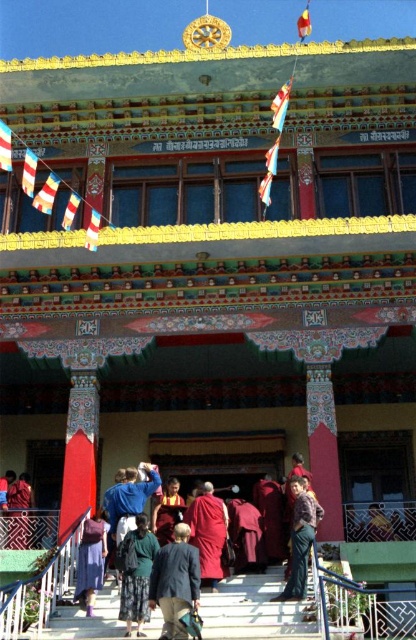
You are a visitor standing in front of the monastery and notice two items of clothing near the entrance. The green fabric skirt at center and the denim pants at lower center. Which one is positioned lower in relation to the other?

The green fabric skirt at center is located below denim pants at lower center, so it is positioned lower than the denim pants at lower center.

You are a visitor standing in front of the monastery. You notice a red velvet robe at lower left and a red fabric flag at upper center. Which object is higher up in the image?

The red fabric flag at upper center is higher up in the image than the red velvet robe at lower left.

You are a photographer standing in front of the monastery. You want to capture both the dark blue fabric jacket at lower center and the maroon woolen robe at center in a single photo. Which item of clothing will appear bigger in the photo?

The dark blue fabric jacket at lower center will appear bigger in the photo because it has a larger size compared to the maroon woolen robe at center.